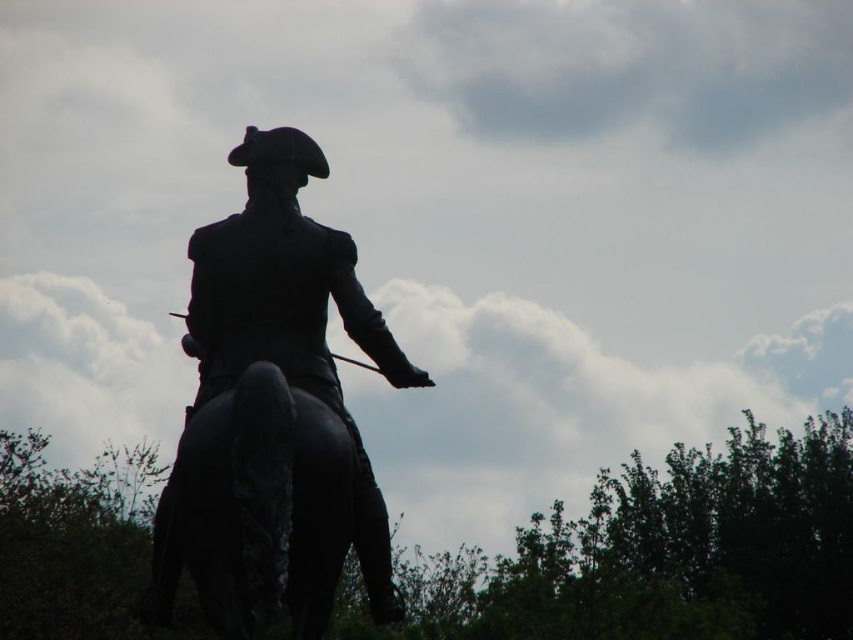
Can you confirm if black polished statue at center is positioned above shiny black horse at center?

Yes, black polished statue at center is above shiny black horse at center.

Who is more distant from viewer, (170, 595) or (167, 502)?

Point (170, 595)

Where is `black polished statue at center`? The width and height of the screenshot is (853, 640). black polished statue at center is located at coordinates (273, 413).